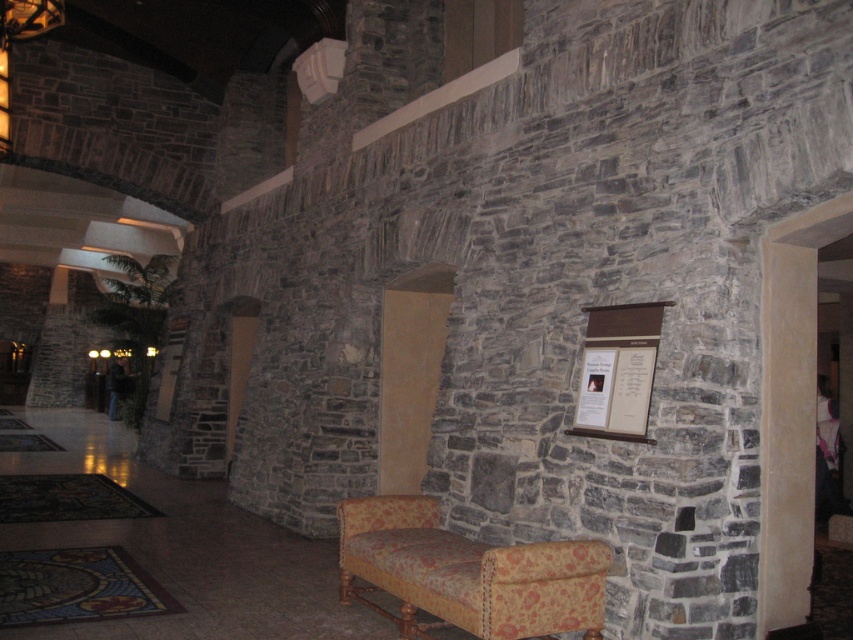
Which is more to the right, floral-patterned fabric chaise lounge at center or brown wood sign at center?

brown wood sign at center is more to the right.

This screenshot has width=853, height=640. What do you see at coordinates (469, 572) in the screenshot?
I see `floral-patterned fabric chaise lounge at center` at bounding box center [469, 572].

Which is behind, point (422, 515) or point (607, 330)?

The point (422, 515) is more distant.

The image size is (853, 640). I want to click on floral-patterned fabric chaise lounge at center, so click(x=469, y=572).